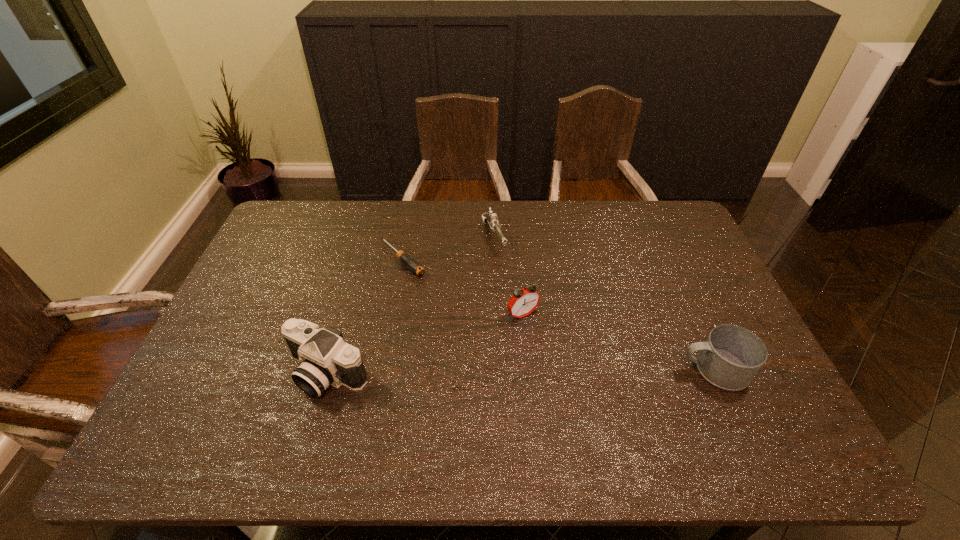
Locate an element on the screen. This screenshot has height=540, width=960. unoccupied area between the third nearest object and the gun is located at coordinates (508, 276).

I want to click on free space between the mug and the screwdriver, so click(x=558, y=314).

You are a GUI agent. You are given a task and a screenshot of the screen. Output one action in this format:
    pyautogui.click(x=<x>, y=<y>)
    Task: Click on the vacant space in between the screwdriver and the rightmost object
    
    Given the screenshot: What is the action you would take?
    pyautogui.click(x=558, y=314)

Where is `free space between the camera and the mug`? This screenshot has height=540, width=960. free space between the camera and the mug is located at coordinates (520, 372).

Where is `free space between the gun and the shortest object`? Image resolution: width=960 pixels, height=540 pixels. free space between the gun and the shortest object is located at coordinates (448, 248).

What are the coordinates of `free spot between the mug and the third nearest object` in the screenshot? It's located at (618, 342).

Where is `vacant area between the gun and the rightmost object`? vacant area between the gun and the rightmost object is located at coordinates (604, 303).

Locate an element on the screen. vacant point located between the alarm clock and the shortest object is located at coordinates (463, 287).

Identify the location of unoccupied position between the gun and the tallest object. The height and width of the screenshot is (540, 960). (411, 305).

Locate which object ranks in proximity to the rightmost object. Please provide its 2D coordinates. Your answer should be formatted as a tuple, i.e. [(x, y)], where the tuple contains the x and y coordinates of a point satisfying the conditions above.

[(524, 301)]